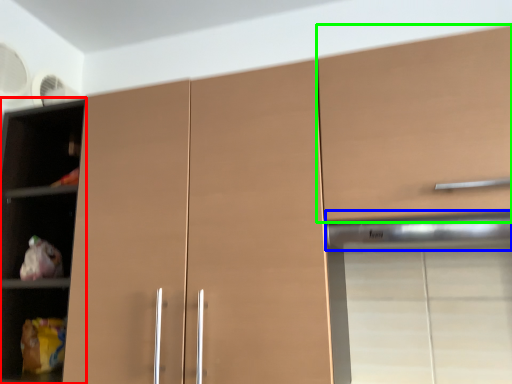
Question: Which object is the closest to the cupboard (highlighted by a red box)? Choose among these: exhaust hood (highlighted by a blue box) or cabinetry (highlighted by a green box).

Choices:
 (A) exhaust hood
 (B) cabinetry

Answer: (B)